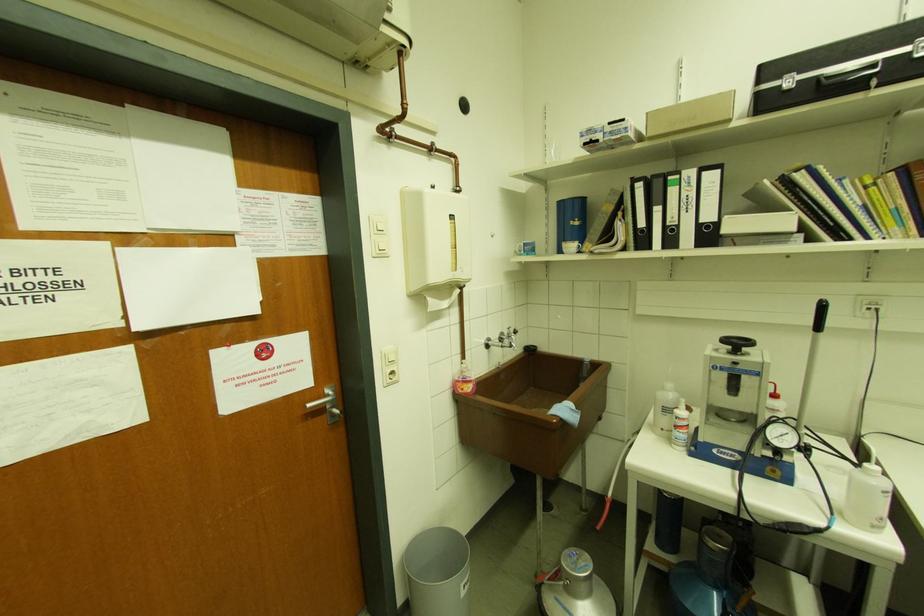
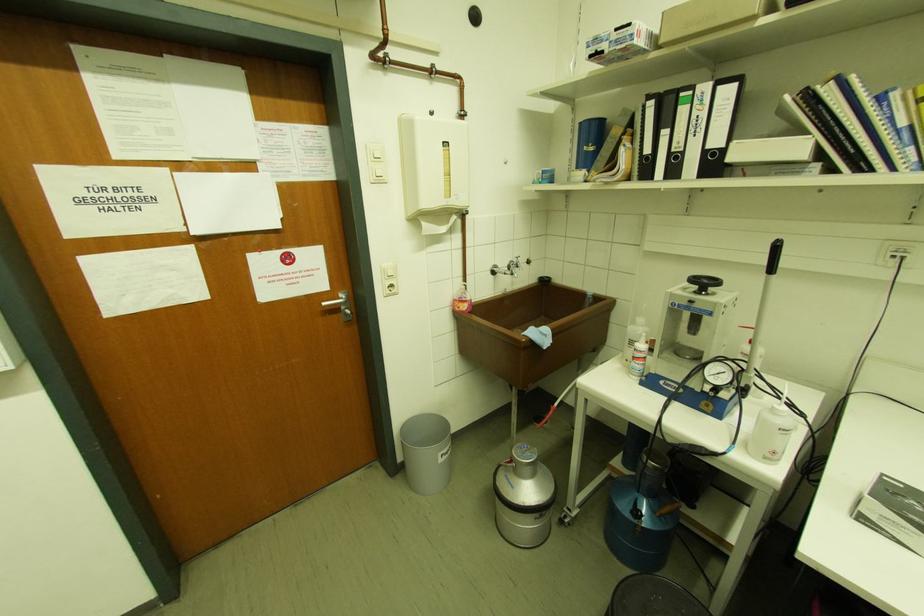
Locate, in the second image, the point that corresponds to the point at 468,582 in the first image.

(446, 453)